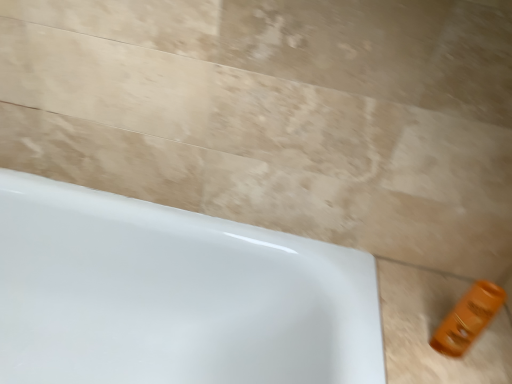
This screenshot has height=384, width=512. Describe the element at coordinates (173, 295) in the screenshot. I see `white glossy bathtub at lower left` at that location.

The height and width of the screenshot is (384, 512). What are the coordinates of `white glossy bathtub at lower left` in the screenshot? It's located at (173, 295).

Find the location of a particular element. white glossy bathtub at lower left is located at coordinates coord(173,295).